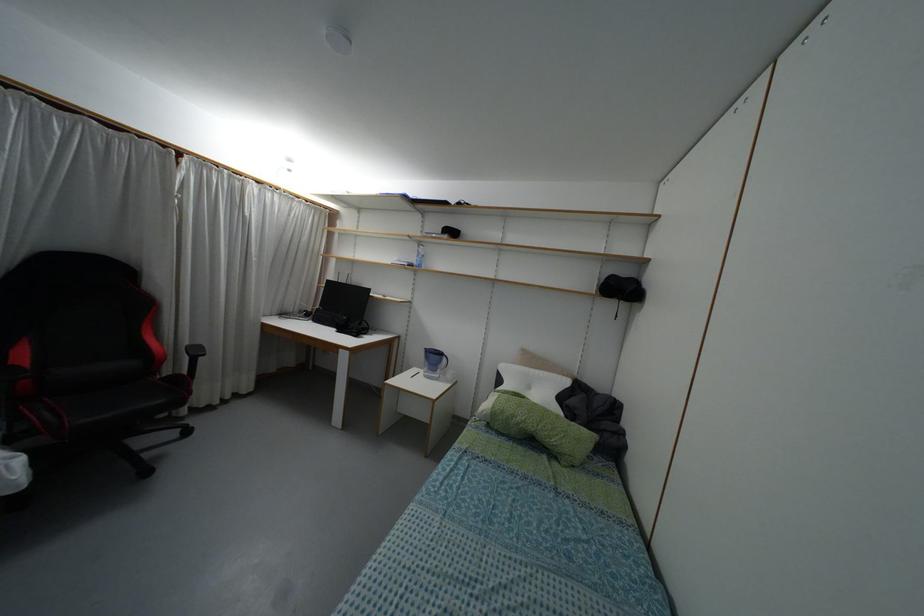
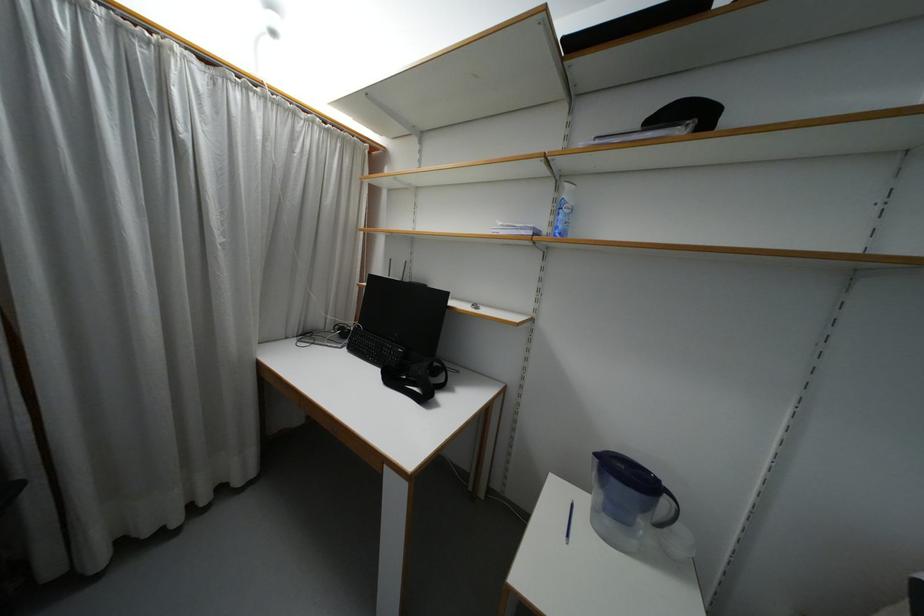
The images are taken continuously from a first-person perspective. In which direction are you moving?

The cameraman walked toward left, forward.